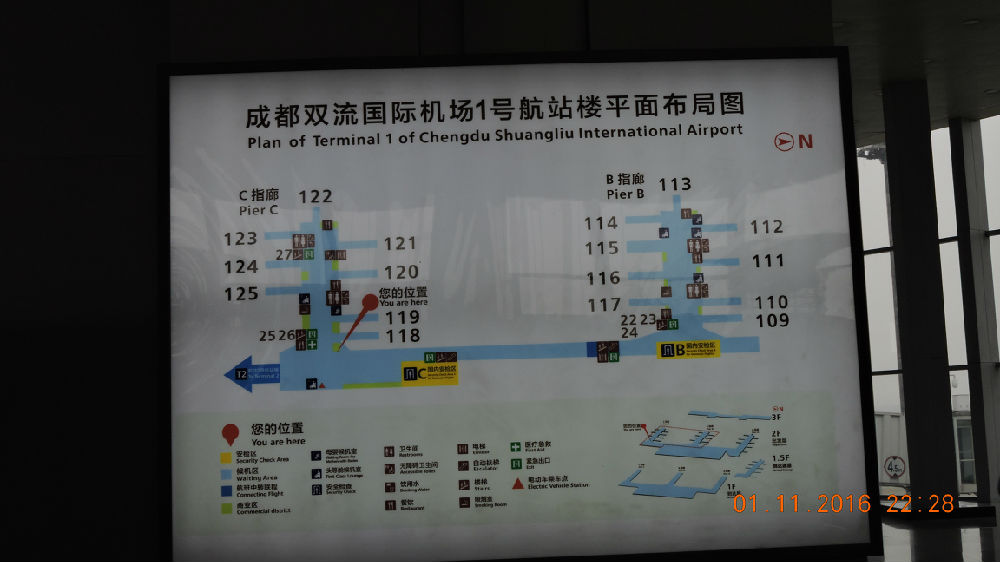
Identify the location of tv frame left. Image resolution: width=1000 pixels, height=562 pixels. (161, 312).